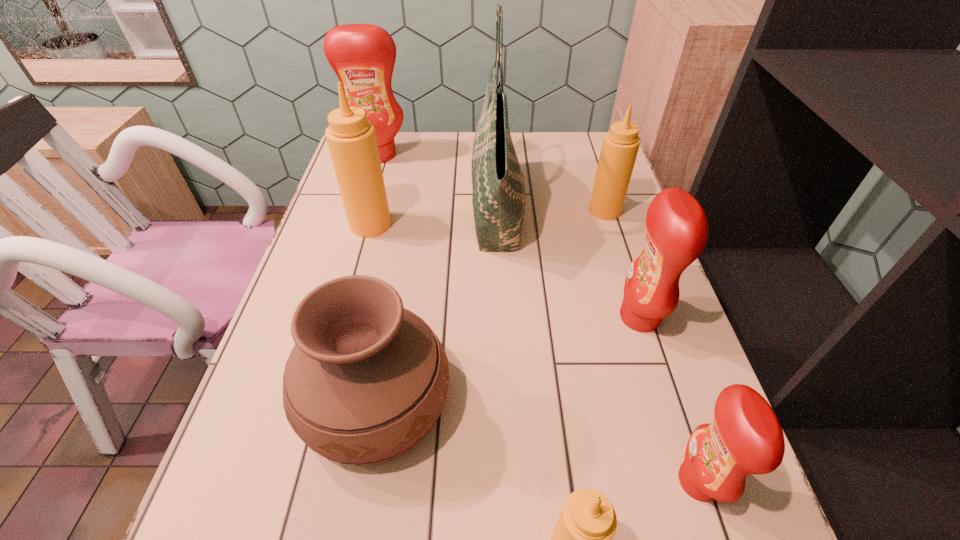
Where is `green tote bag`? green tote bag is located at coordinates (498, 199).

The width and height of the screenshot is (960, 540). Find the location of `the tallest object`. the tallest object is located at coordinates (498, 199).

I want to click on the farthest red condiment, so click(363, 56).

The width and height of the screenshot is (960, 540). Identify the location of the farthest condiment. (363, 56).

Locate an element on the screen. This screenshot has width=960, height=540. the leftmost tan condiment is located at coordinates (351, 139).

Where is `the rightmost tan condiment`? the rightmost tan condiment is located at coordinates (620, 146).

The image size is (960, 540). I want to click on the third nearest condiment, so click(677, 231).

The width and height of the screenshot is (960, 540). What are the coordinates of `the second biggest red condiment` in the screenshot? It's located at (677, 231).

This screenshot has width=960, height=540. What are the coordinates of `urn` in the screenshot? It's located at pyautogui.click(x=367, y=379).

The image size is (960, 540). I want to click on the nearest red condiment, so click(745, 437).